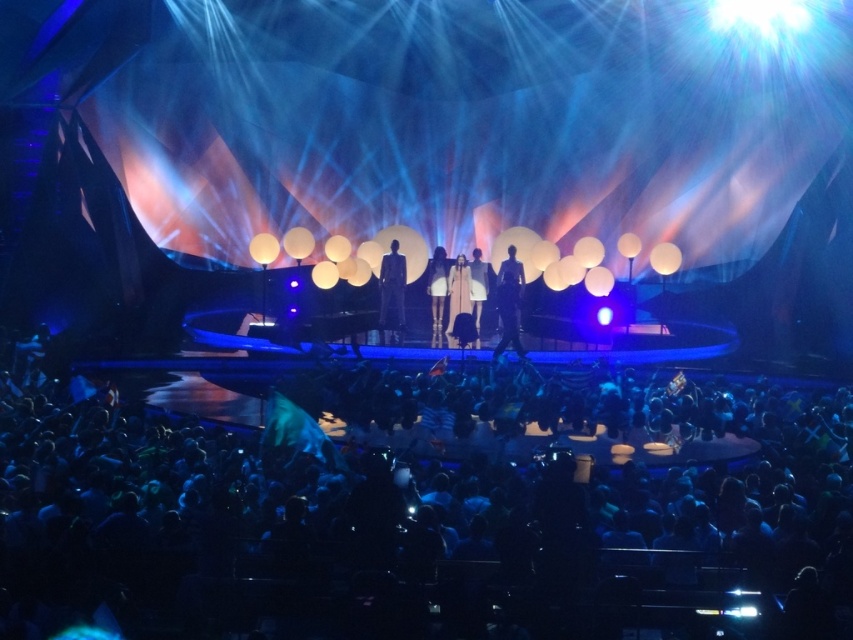
Question: Which object is farther from the camera taking this photo?

Choices:
 (A) silky white dress at center
 (B) dark gray suit at center
 (C) black fabric crowd at lower center
 (D) white leather boots at center

Answer: (A)

Question: Is black fabric crowd at lower center smaller than white matte dress at center?

Choices:
 (A) yes
 (B) no

Answer: (B)

Question: Can you confirm if black fabric crowd at lower center is bigger than white matte dress at center?

Choices:
 (A) yes
 (B) no

Answer: (A)

Question: Which point appears farthest from the camera in this image?

Choices:
 (A) (828, 520)
 (B) (459, 259)
 (C) (398, 339)
 (D) (514, 317)

Answer: (B)

Question: Estimate the real-world distances between objects in this image. Which object is closer to the black fabric crowd at lower center?

Choices:
 (A) white matte dress at center
 (B) matte black suit at center
 (C) white leather boots at center

Answer: (B)

Question: Can you confirm if black fabric crowd at lower center is positioned below silky white dress at center?

Choices:
 (A) yes
 (B) no

Answer: (A)